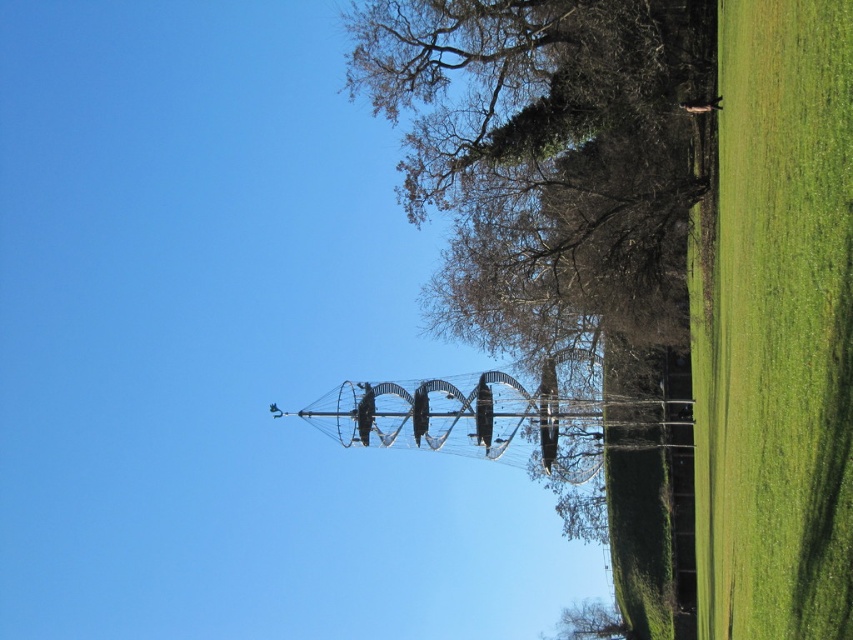
How distant is green grass at right from green leafy tree at lower center?

They are 37.91 meters apart.

Looking at this image, is green grass at right shorter than green leafy tree at lower center?

In fact, green grass at right may be taller than green leafy tree at lower center.

Describe the element at coordinates (775, 326) in the screenshot. This screenshot has height=640, width=853. I see `green grass at right` at that location.

Find the location of `green grass at right`. green grass at right is located at coordinates (775, 326).